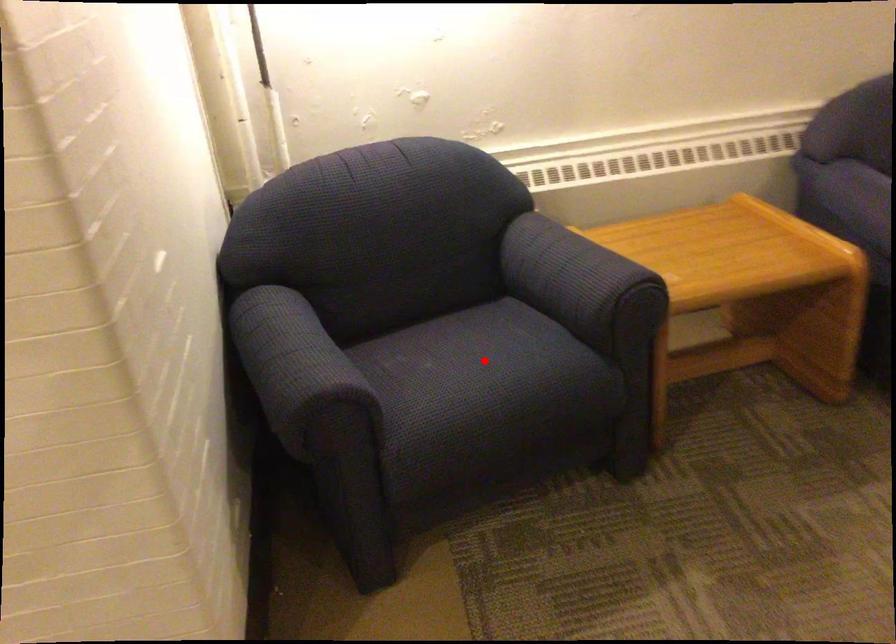
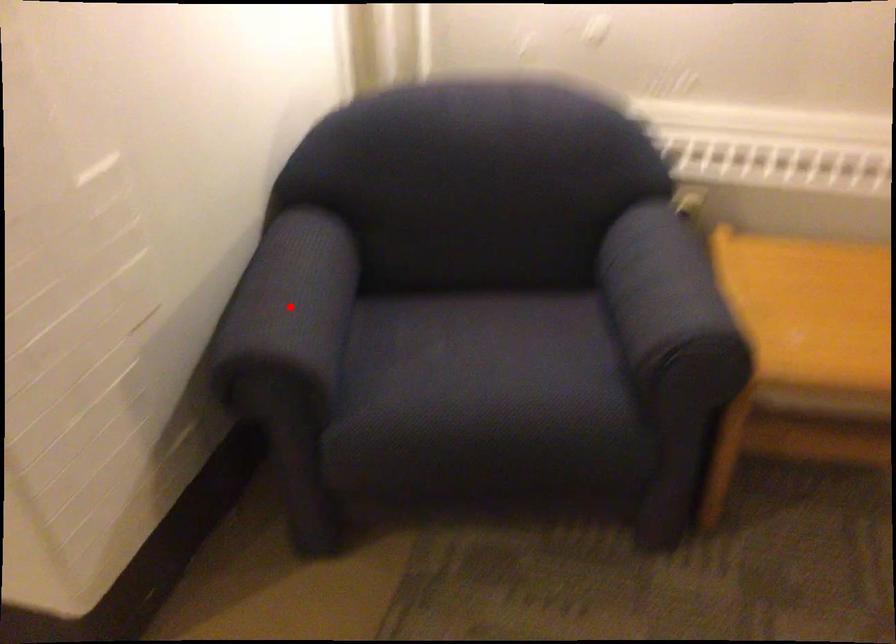
I am providing you with two images of the same scene from different viewpoints. A red point is marked on the first image and another point is marked on the second image. Does the point marked in image1 correspond to the same location as the one in image2?

No